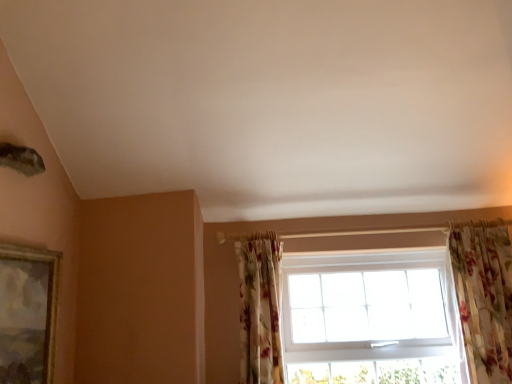
What do you see at coordinates (259, 307) in the screenshot?
I see `floral fabric curtain at lower right, marked as the 2th curtain in a right-to-left arrangement` at bounding box center [259, 307].

This screenshot has width=512, height=384. In order to click on floral fabric curtain at lower right, marked as the 2th curtain in a right-to-left arrangement in this screenshot , I will do `click(259, 307)`.

Where is `white plastic window at center`? white plastic window at center is located at coordinates click(367, 308).

Describe the element at coordinates (27, 313) in the screenshot. The width and height of the screenshot is (512, 384). I see `gold-framed painting at left` at that location.

The height and width of the screenshot is (384, 512). Find the location of `floral fabric curtain at lower right, which is counted as the first curtain, starting from the left`. floral fabric curtain at lower right, which is counted as the first curtain, starting from the left is located at coordinates (259, 307).

From the picture: Looking at the image, does gold-framed painting at left seem bigger or smaller compared to floral fabric curtain at lower right, which is counted as the first curtain, starting from the left?

In the image, gold-framed painting at left appears to be smaller than floral fabric curtain at lower right, which is counted as the first curtain, starting from the left.

Looking at their sizes, would you say gold-framed painting at left is wider or thinner than floral fabric curtain at lower right, marked as the 2th curtain in a right-to-left arrangement?

In the image, gold-framed painting at left appears to be more narrow than floral fabric curtain at lower right, marked as the 2th curtain in a right-to-left arrangement.

Which is less distant, (9,339) or (270,294)?

Clearly, point (9,339) is closer to the camera than point (270,294).

From the picture: Considering the sizes of gold-framed painting at left and floral fabric curtain at lower right, marked as the 2th curtain in a right-to-left arrangement, in the image, is gold-framed painting at left taller or shorter than floral fabric curtain at lower right, marked as the 2th curtain in a right-to-left arrangement,?

Clearly, gold-framed painting at left is shorter compared to floral fabric curtain at lower right, marked as the 2th curtain in a right-to-left arrangement.

Based on the photo, in terms of width, does floral fabric curtain at lower right, which is counted as the first curtain, starting from the left, look wider or thinner when compared to gold-framed painting at left?

In the image, floral fabric curtain at lower right, which is counted as the first curtain, starting from the left, appears to be wider than gold-framed painting at left.

Measure the distance between floral fabric curtain at lower right, which is counted as the first curtain, starting from the left, and gold-framed painting at left.

They are 36.44 inches apart.

From the image's perspective, who appears lower, floral fabric curtain at lower right, which is counted as the first curtain, starting from the left, or gold-framed painting at left?

floral fabric curtain at lower right, which is counted as the first curtain, starting from the left, appears lower in the image.

Considering the relative positions of floral fabric curtain at lower right, marked as the 2th curtain in a right-to-left arrangement, and gold-framed painting at left in the image provided, is floral fabric curtain at lower right, marked as the 2th curtain in a right-to-left arrangement, to the left or to the right of gold-framed painting at left?

From the image, it's evident that floral fabric curtain at lower right, marked as the 2th curtain in a right-to-left arrangement, is to the right of gold-framed painting at left.

Based on the photo, could you tell me if white plastic window at center is facing gold-framed painting at left?

No, white plastic window at center is not turned towards gold-framed painting at left.

Who is shorter, white plastic window at center or gold-framed painting at left?

gold-framed painting at left.

From the image's perspective, is white plastic window at center under gold-framed painting at left?

Correct, white plastic window at center appears lower than gold-framed painting at left in the image.

Is floral fabric curtain at right, the 1th curtain in the right-to-left sequence, facing away from floral fabric curtain at lower right, which is counted as the first curtain, starting from the left?

No, floral fabric curtain at right, the 1th curtain in the right-to-left sequence,'s orientation is not away from floral fabric curtain at lower right, which is counted as the first curtain, starting from the left.

Is the surface of floral fabric curtain at right, the 1th curtain in the right-to-left sequence, in direct contact with floral fabric curtain at lower right, marked as the 2th curtain in a right-to-left arrangement?

floral fabric curtain at right, the 1th curtain in the right-to-left sequence, is not next to floral fabric curtain at lower right, marked as the 2th curtain in a right-to-left arrangement, and they're not touching.

Relative to floral fabric curtain at lower right, which is counted as the first curtain, starting from the left, is floral fabric curtain at right, the 1th curtain in the right-to-left sequence, in front or behind?

In the image, floral fabric curtain at right, the 1th curtain in the right-to-left sequence, appears in front of floral fabric curtain at lower right, which is counted as the first curtain, starting from the left.

Can white plastic window at center be found inside floral fabric curtain at right, the 1th curtain in the right-to-left sequence?

No.

Which is behind, point (487, 319) or point (325, 260)?

Point (325, 260)

From the image's perspective, which is above, floral fabric curtain at right, acting as the second curtain starting from the left, or white plastic window at center?

floral fabric curtain at right, acting as the second curtain starting from the left, appears higher in the image.

Is floral fabric curtain at right, the 1th curtain in the right-to-left sequence, oriented towards white plastic window at center?

No, floral fabric curtain at right, the 1th curtain in the right-to-left sequence, is not facing towards white plastic window at center.

Which object is thinner, floral fabric curtain at right, the 1th curtain in the right-to-left sequence, or gold-framed painting at left?

gold-framed painting at left is thinner.

Visually, is floral fabric curtain at right, acting as the second curtain starting from the left, positioned to the left or to the right of gold-framed painting at left?

floral fabric curtain at right, acting as the second curtain starting from the left, is positioned on gold-framed painting at left's right side.

Does floral fabric curtain at right, acting as the second curtain starting from the left, turn towards gold-framed painting at left?

No, floral fabric curtain at right, acting as the second curtain starting from the left, is not turned towards gold-framed painting at left.

Between floral fabric curtain at right, acting as the second curtain starting from the left, and gold-framed painting at left, which one has more height?

floral fabric curtain at right, acting as the second curtain starting from the left, is taller.

Between gold-framed painting at left and white plastic window at center, which one has more height?

With more height is white plastic window at center.

From the image's perspective, which object appears higher, gold-framed painting at left or white plastic window at center?

gold-framed painting at left, from the image's perspective.

Is gold-framed painting at left not close to white plastic window at center?

gold-framed painting at left is far away from white plastic window at center.

I want to click on window on the right side of gold-framed painting at left, so click(x=367, y=308).

Find the location of a particular element. Image resolution: width=512 pixels, height=384 pixels. picture frame above the floral fabric curtain at lower right, which is counted as the first curtain, starting from the left (from the image's perspective) is located at coordinates [x=27, y=313].

From the image's perspective, which curtain is the 2nd one below the gold-framed painting at left? Please provide its 2D coordinates.

[(259, 307)]

From the image, which object appears to be nearer to white plastic window at center, floral fabric curtain at right, acting as the second curtain starting from the left, or floral fabric curtain at lower right, marked as the 2th curtain in a right-to-left arrangement?

floral fabric curtain at right, acting as the second curtain starting from the left, lies closer to white plastic window at center than the other object.

Estimate the real-world distances between objects in this image. Which object is closer to floral fabric curtain at right, acting as the second curtain starting from the left, floral fabric curtain at lower right, which is counted as the first curtain, starting from the left, or white plastic window at center?

The object closer to floral fabric curtain at right, acting as the second curtain starting from the left, is white plastic window at center.

From the image, which object appears to be nearer to floral fabric curtain at lower right, marked as the 2th curtain in a right-to-left arrangement, gold-framed painting at left or floral fabric curtain at right, the 1th curtain in the right-to-left sequence?

gold-framed painting at left lies closer to floral fabric curtain at lower right, marked as the 2th curtain in a right-to-left arrangement, than the other object.

Looking at the image, which one is located further to white plastic window at center, gold-framed painting at left or floral fabric curtain at right, acting as the second curtain starting from the left?

gold-framed painting at left is further to white plastic window at center.

Which object lies further to the anchor point gold-framed painting at left, floral fabric curtain at right, acting as the second curtain starting from the left, or floral fabric curtain at lower right, which is counted as the first curtain, starting from the left?

Among the two, floral fabric curtain at right, acting as the second curtain starting from the left, is located further to gold-framed painting at left.

When comparing their distances from white plastic window at center, does floral fabric curtain at right, acting as the second curtain starting from the left, or gold-framed painting at left seem further?

gold-framed painting at left is further to white plastic window at center.

When comparing their distances from floral fabric curtain at right, acting as the second curtain starting from the left, does white plastic window at center or floral fabric curtain at lower right, marked as the 2th curtain in a right-to-left arrangement, seem further?

floral fabric curtain at lower right, marked as the 2th curtain in a right-to-left arrangement, is further to floral fabric curtain at right, acting as the second curtain starting from the left.

When comparing their distances from gold-framed painting at left, does floral fabric curtain at right, the 1th curtain in the right-to-left sequence, or white plastic window at center seem further?

floral fabric curtain at right, the 1th curtain in the right-to-left sequence, is further to gold-framed painting at left.

This screenshot has width=512, height=384. I want to click on window between floral fabric curtain at lower right, marked as the 2th curtain in a right-to-left arrangement, and floral fabric curtain at right, acting as the second curtain starting from the left, from left to right, so click(x=367, y=308).

Image resolution: width=512 pixels, height=384 pixels. Find the location of `window between gold-framed painting at left and floral fabric curtain at right, the 1th curtain in the right-to-left sequence, in the horizontal direction`. window between gold-framed painting at left and floral fabric curtain at right, the 1th curtain in the right-to-left sequence, in the horizontal direction is located at coordinates 367,308.

Where is `curtain located between gold-framed painting at left and white plastic window at center in the left-right direction`? The height and width of the screenshot is (384, 512). curtain located between gold-framed painting at left and white plastic window at center in the left-right direction is located at coordinates (259, 307).

The height and width of the screenshot is (384, 512). In order to click on curtain between gold-framed painting at left and floral fabric curtain at right, the 1th curtain in the right-to-left sequence, from left to right in this screenshot , I will do `click(259, 307)`.